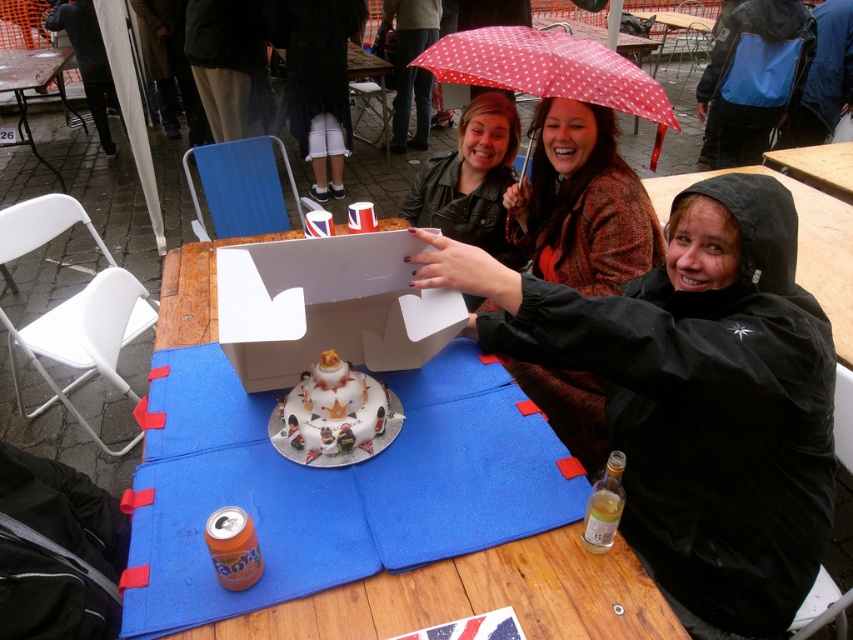
Is the position of black matte raincoat at lower right less distant than that of polka dot fabric umbrella at upper center?

Yes.

Who is shorter, black matte raincoat at lower right or polka dot fabric umbrella at upper center?

polka dot fabric umbrella at upper center

Locate an element on the screen. This screenshot has width=853, height=640. black matte raincoat at lower right is located at coordinates point(695,396).

Can you confirm if blue felt table at center is bigger than black matte jacket at lower right?

No.

Between blue felt table at center and black matte jacket at lower right, which one is positioned higher?

black matte jacket at lower right

This screenshot has height=640, width=853. What do you see at coordinates (477, 596) in the screenshot? I see `blue felt table at center` at bounding box center [477, 596].

Identify the location of blue felt table at center. This screenshot has height=640, width=853. (477, 596).

Which is behind, point (380, 278) or point (836, 161)?

The point (836, 161) is behind.

This screenshot has width=853, height=640. What do you see at coordinates (328, 307) in the screenshot?
I see `white cardboard box at center` at bounding box center [328, 307].

The width and height of the screenshot is (853, 640). What are the coordinates of `white cardboard box at center` in the screenshot? It's located at (328, 307).